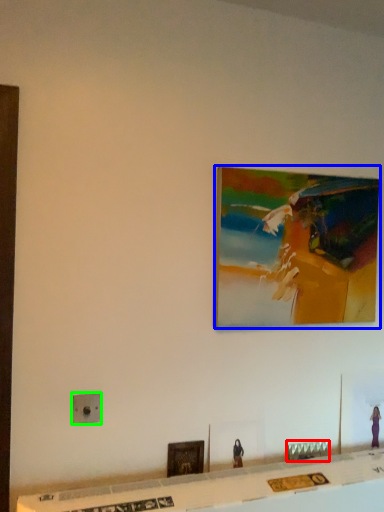
Question: Based on their relative distances, which object is farther from furniture (highlighted by a red box)? Choose from picture frame (highlighted by a blue box) and electric outlet (highlighted by a green box).

Choices:
 (A) picture frame
 (B) electric outlet

Answer: (B)